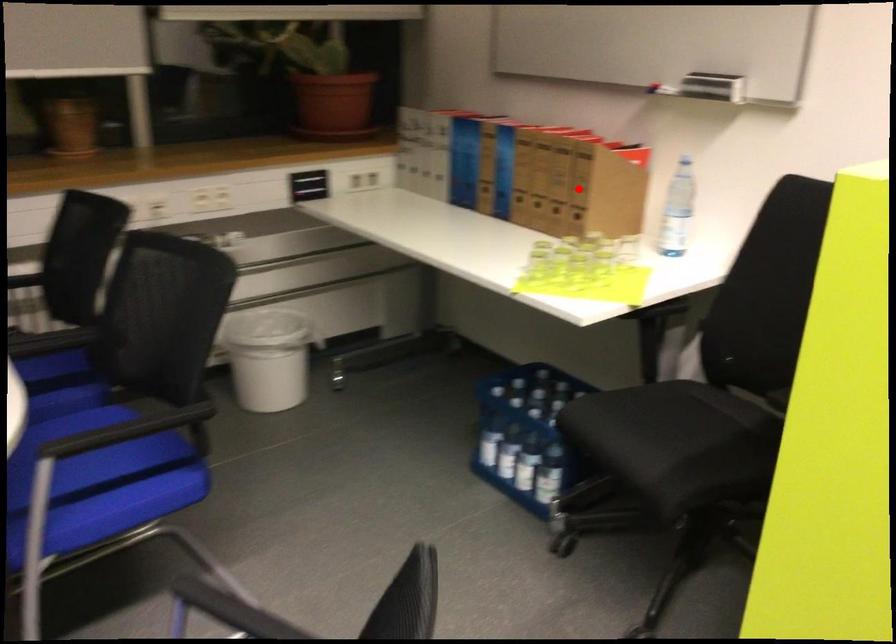
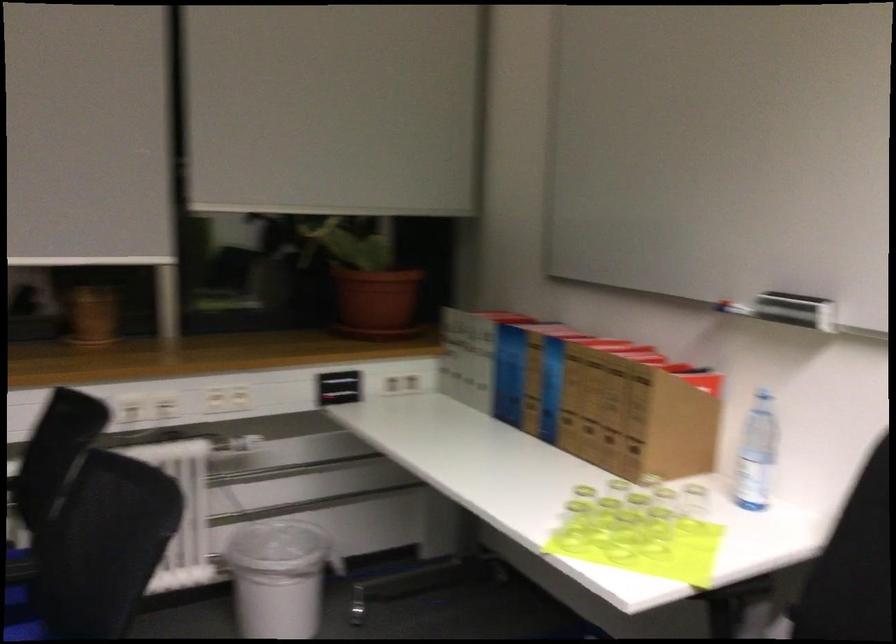
Question: I am providing you with two images of the same scene from different viewpoints. Image1 has a red point marked. In image2, the corresponding 3D location appears at what relative position? Reply with the corresponding letter.

Choices:
 (A) Closer
 (B) Farther

Answer: (A)